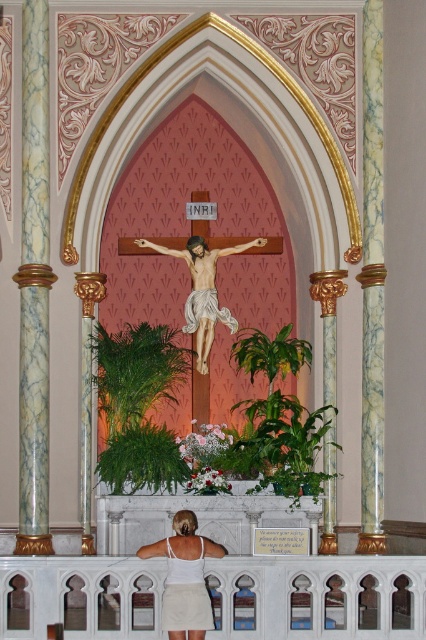
Question: Among these objects, which one is nearest to the camera?

Choices:
 (A) white fabric at lower center
 (B) marble column at left
 (C) wooden crucifix at center

Answer: (A)

Question: Can you confirm if marble column at left is wider than white fabric at lower center?

Choices:
 (A) no
 (B) yes

Answer: (A)

Question: Based on their relative distances, which object is nearer to the wooden crucifix at center?

Choices:
 (A) marble column at left
 (B) white fabric at lower center

Answer: (A)

Question: Does marble column at left come behind wooden crucifix at center?

Choices:
 (A) yes
 (B) no

Answer: (B)

Question: Considering the relative positions of marble column at left and white fabric at lower center in the image provided, where is marble column at left located with respect to white fabric at lower center?

Choices:
 (A) right
 (B) left

Answer: (B)

Question: Which object appears closest to the camera in this image?

Choices:
 (A) white fabric at lower center
 (B) wooden crucifix at center
 (C) marble column at left

Answer: (A)